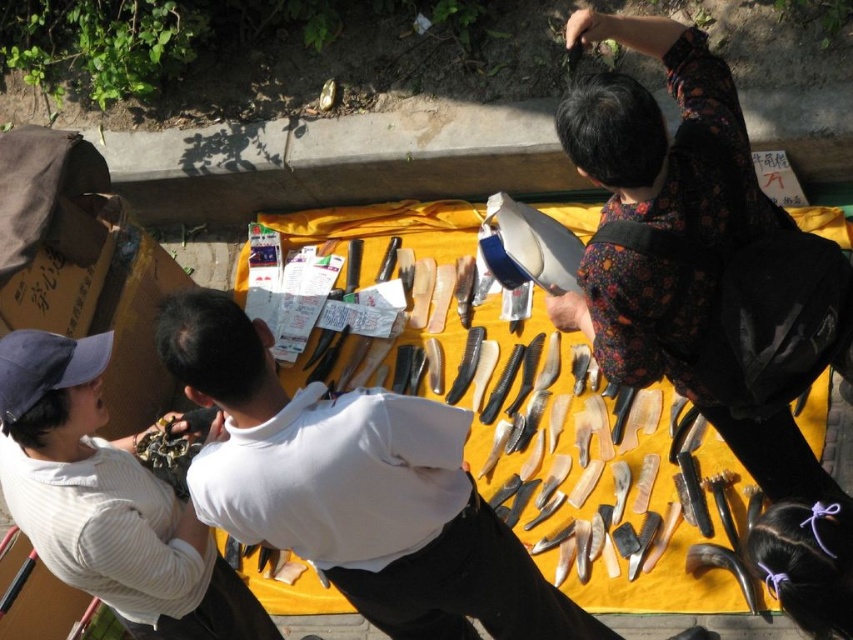
Is yellow fabric at center to the right of black leather shoe at lower right from the viewer's perspective?

Incorrect, yellow fabric at center is not on the right side of black leather shoe at lower right.

Can you confirm if yellow fabric at center is smaller than black leather shoe at lower right?

No, yellow fabric at center is not smaller than black leather shoe at lower right.

Between point (444, 340) and point (695, 636), which one is positioned behind?

Positioned behind is point (444, 340).

Find the location of a particular element. The width and height of the screenshot is (853, 640). yellow fabric at center is located at coordinates (381, 228).

Who is shorter, white matte shirt at center or black leather shoe at lower right?

Standing shorter between the two is black leather shoe at lower right.

At what (x,y) coordinates should I click in order to perform the action: click on white matte shirt at center. Please return your answer as a coordinate pair (x, y). Looking at the image, I should click on (355, 488).

At what (x,y) coordinates should I click in order to perform the action: click on white matte shirt at center. Please return your answer as a coordinate pair (x, y). Image resolution: width=853 pixels, height=640 pixels. Looking at the image, I should click on (355, 488).

Which is more to the left, yellow fabric at center or white matte shirt at upper left?

white matte shirt at upper left is more to the left.

Is yellow fabric at center in front of white matte shirt at upper left?

No, yellow fabric at center is behind white matte shirt at upper left.

Locate an element on the screen. The width and height of the screenshot is (853, 640). yellow fabric at center is located at coordinates (381, 228).